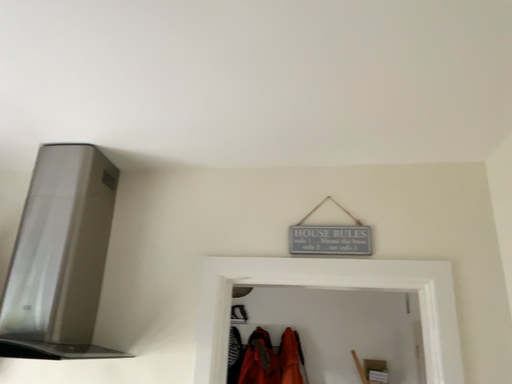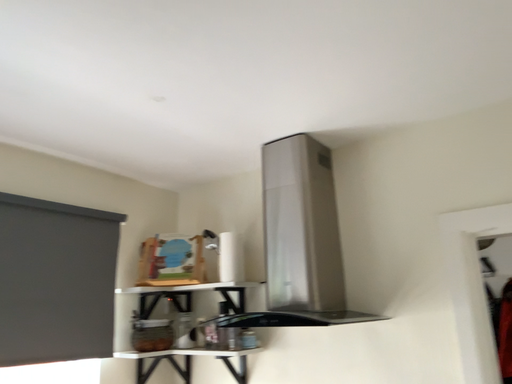
Question: Which way did the camera rotate in the video?

Choices:
 (A) rotated right
 (B) rotated left

Answer: (B)